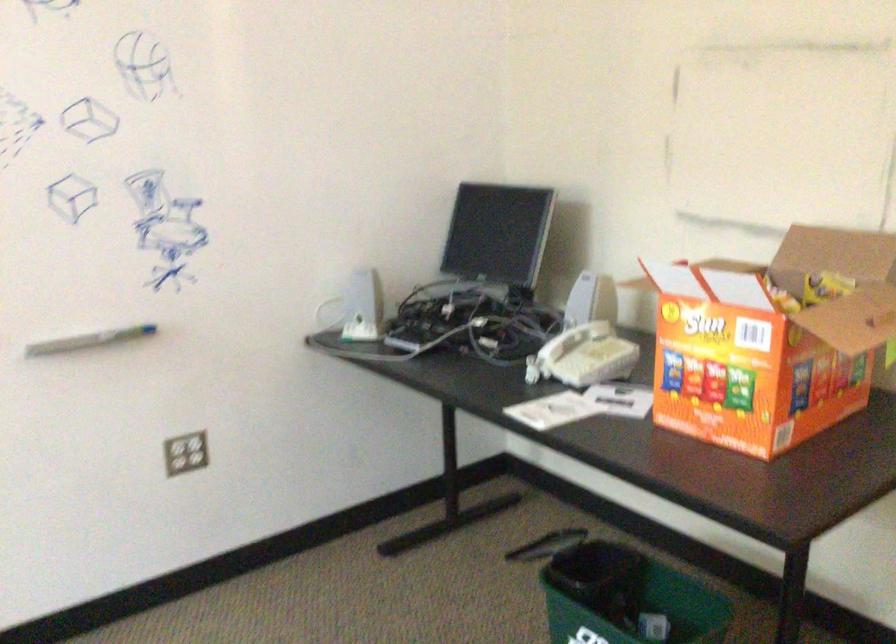
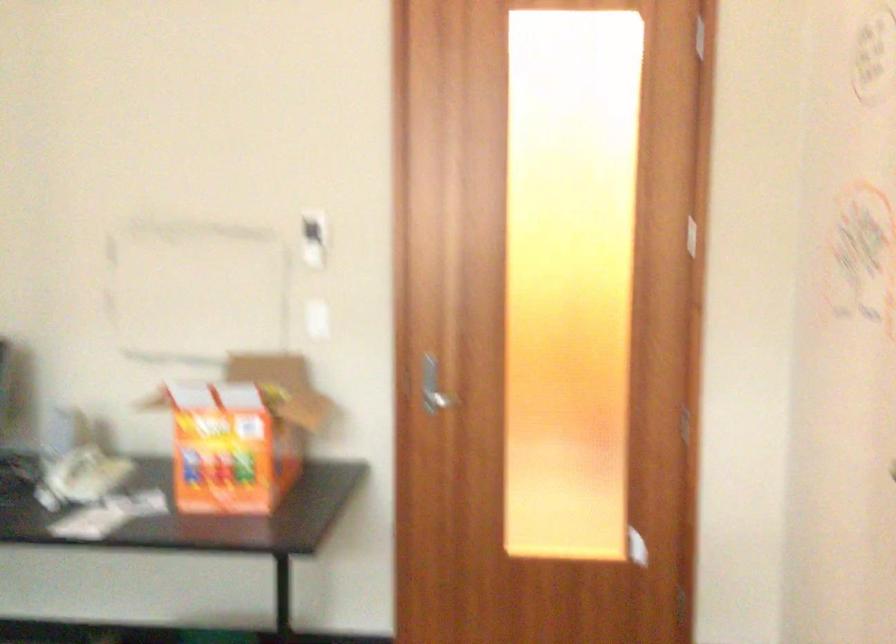
Find the pixel in the second image that matches pixel 782 301 in the first image.

(242, 408)